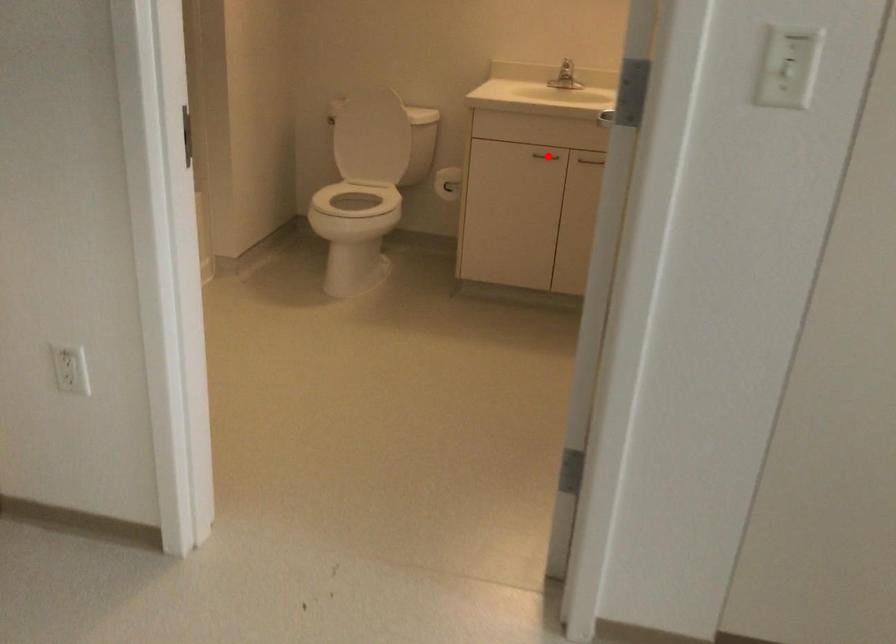
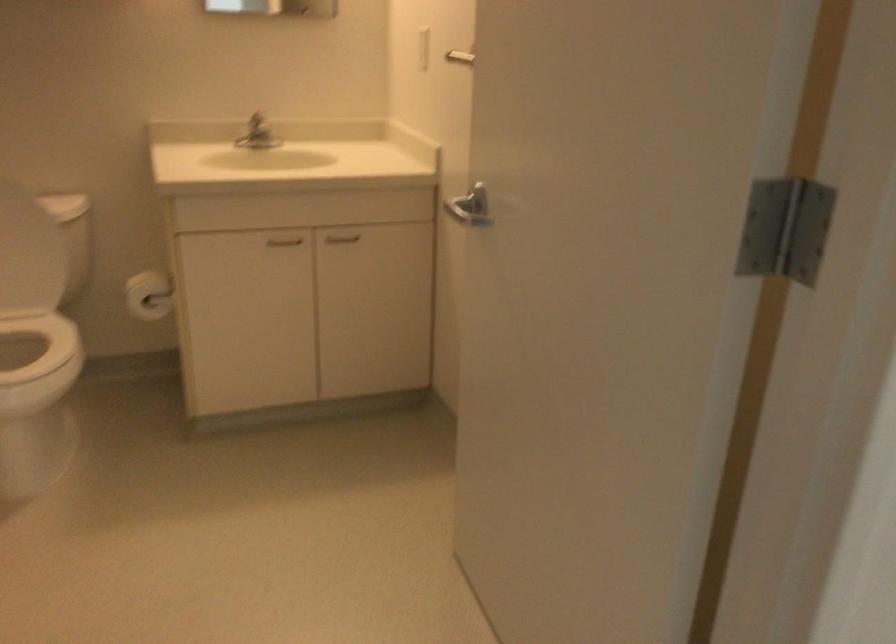
Question: I am providing you with two images of the same scene from different viewpoints. A red point is shown in image1. For the corresponding object point in image2, is it positioned nearer or farther from the camera?

Choices:
 (A) Nearer
 (B) Farther

Answer: (A)